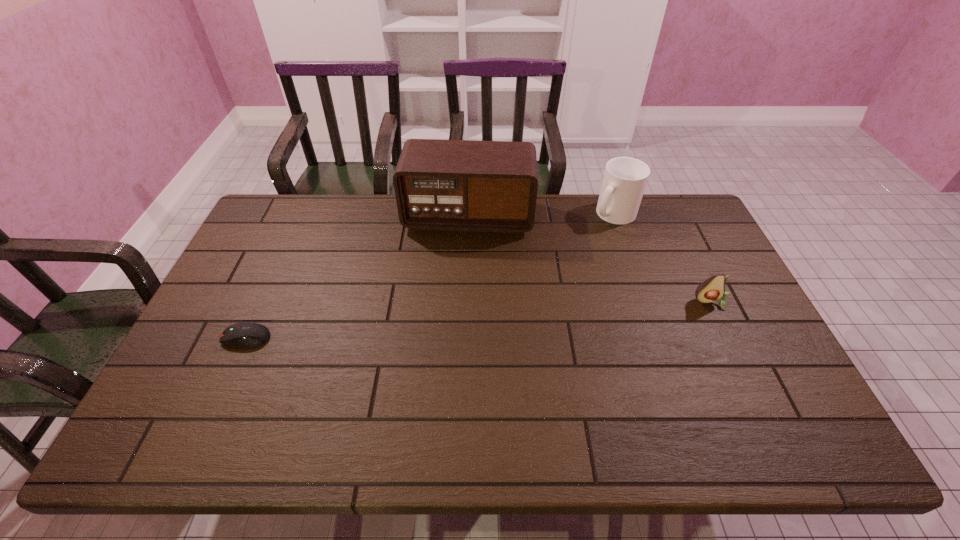
This screenshot has height=540, width=960. Find the location of `computer equipment`. computer equipment is located at coordinates (248, 334).

What are the coordinates of `the leftmost object` in the screenshot? It's located at (248, 334).

Identify the location of avocado. The height and width of the screenshot is (540, 960). click(713, 289).

You are a GUI agent. You are given a task and a screenshot of the screen. Output one action in this format:
    pyautogui.click(x=<x>, y=<y>)
    Task: Click on the third farthest object
    This screenshot has height=540, width=960.
    Given the screenshot: What is the action you would take?
    pyautogui.click(x=713, y=289)

The width and height of the screenshot is (960, 540). I want to click on the third shortest object, so click(x=625, y=178).

You are a GUI agent. You are given a task and a screenshot of the screen. Output one action in this format:
    pyautogui.click(x=<x>, y=<y>)
    Task: Click on the second object from right to left
    This screenshot has height=540, width=960.
    Given the screenshot: What is the action you would take?
    pyautogui.click(x=625, y=178)

Find the location of a particular element. This screenshot has width=960, height=540. the tallest object is located at coordinates (449, 185).

The height and width of the screenshot is (540, 960). In order to click on radio receiver in this screenshot , I will do `click(449, 185)`.

The height and width of the screenshot is (540, 960). What are the coordinates of `vacant region located on the seed side of the second nearest object` in the screenshot? It's located at (735, 352).

Identify the location of free space located on the handle side of the third shortest object. This screenshot has width=960, height=540. (561, 284).